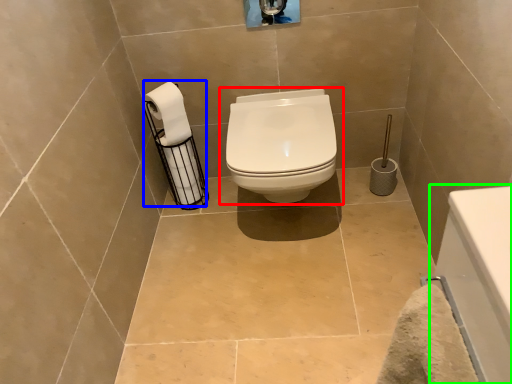
Question: Which object is the farthest from toilet (highlighted by a red box)? Choose among these: toilet paper (highlighted by a blue box) or bath (highlighted by a green box).

Choices:
 (A) toilet paper
 (B) bath

Answer: (B)